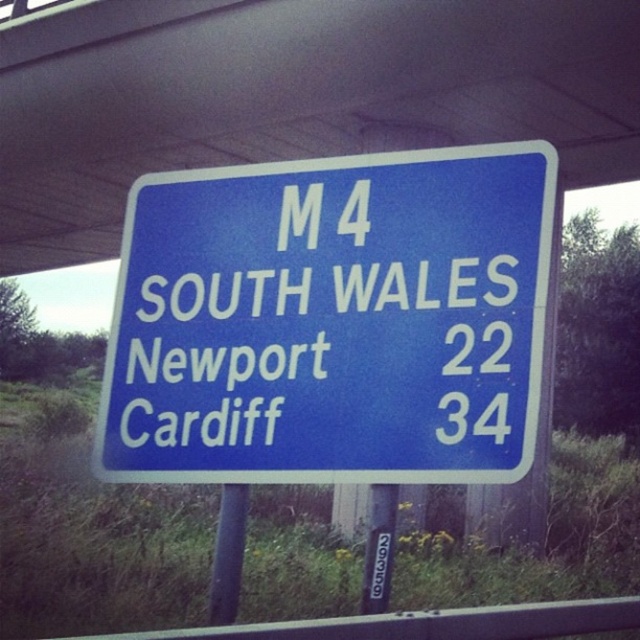
Can you confirm if blue glossy sign at center is positioned above blue plastic sign at upper center?

Actually, blue glossy sign at center is below blue plastic sign at upper center.

Between blue glossy sign at center and blue plastic sign at upper center, which one appears on the left side from the viewer's perspective?

blue plastic sign at upper center is more to the left.

Does point (368, 211) come closer to viewer compared to point (84, 12)?

Yes, it is.

This screenshot has width=640, height=640. In order to click on blue glossy sign at center in this screenshot , I will do `click(321, 317)`.

Does blue glossy sign at center come in front of black metal pole at center?

That is True.

Does blue glossy sign at center appear over black metal pole at center?

Correct, blue glossy sign at center is located above black metal pole at center.

You are a GUI agent. You are given a task and a screenshot of the screen. Output one action in this format:
    pyautogui.click(x=<x>, y=<y>)
    Task: Click on the blue glossy sign at center
    This screenshot has height=640, width=640.
    Given the screenshot: What is the action you would take?
    pyautogui.click(x=321, y=317)

This screenshot has width=640, height=640. I want to click on blue glossy sign at center, so click(321, 317).

Image resolution: width=640 pixels, height=640 pixels. Describe the element at coordinates (291, 96) in the screenshot. I see `blue plastic sign at upper center` at that location.

Is blue plastic sign at upper center smaller than black metal pole at center?

No, blue plastic sign at upper center is not smaller than black metal pole at center.

At what (x,y) coordinates should I click in order to perform the action: click on blue plastic sign at upper center. Please return your answer as a coordinate pair (x, y). Image resolution: width=640 pixels, height=640 pixels. Looking at the image, I should click on (291, 96).